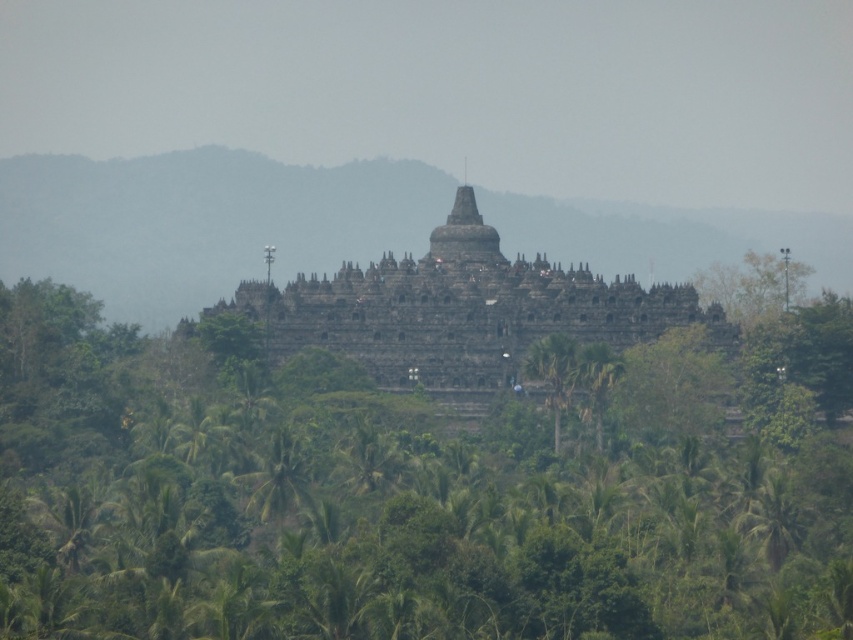
You are standing in front of the temple and want to place two markers at point [44,515] and point [462,385]. Which point is closer to you?

Point [44,515] is closer to the viewer than point [462,385].

You are a tourist standing in front of the dark stone hindu temple at center and the green leafy palm tree at lower center. Which object would appear closer to you based on their sizes in the image?

The dark stone hindu temple at center is bigger than the green leafy palm tree at lower center, so the temple appears closer to you because larger objects in the foreground are typically closer in perspective.